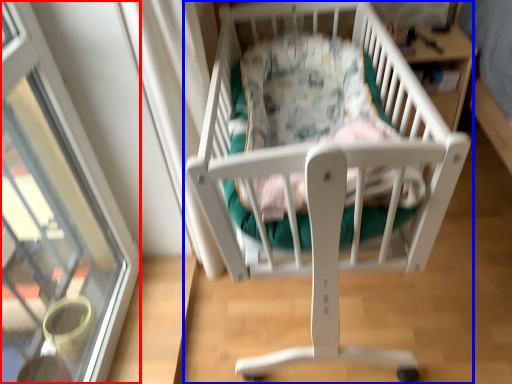
Question: Among these objects, which one is farthest to the camera, glass door (highlighted by a red box) or infant bed (highlighted by a blue box)?

Choices:
 (A) glass door
 (B) infant bed

Answer: (B)